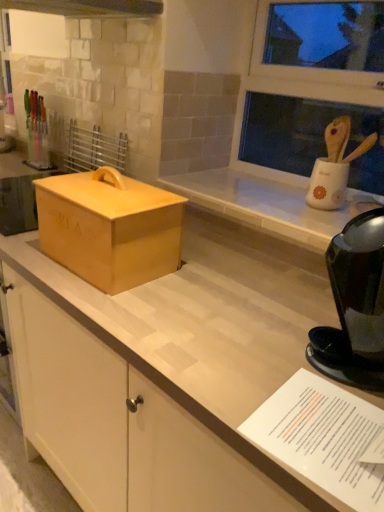
Question: Does black glossy coffee maker at right have a lesser width compared to white paper at lower right?

Choices:
 (A) yes
 (B) no

Answer: (A)

Question: From a real-world perspective, is black glossy coffee maker at right under white paper at lower right?

Choices:
 (A) no
 (B) yes

Answer: (A)

Question: Is black glossy coffee maker at right in contact with white paper at lower right?

Choices:
 (A) yes
 (B) no

Answer: (B)

Question: Is white paper at lower right at the back of black glossy coffee maker at right?

Choices:
 (A) yes
 (B) no

Answer: (B)

Question: Can you confirm if black glossy coffee maker at right is bigger than white paper at lower right?

Choices:
 (A) yes
 (B) no

Answer: (A)

Question: Considering the positions of white paper at lower right and matte yellow box at center in the image, is white paper at lower right taller or shorter than matte yellow box at center?

Choices:
 (A) short
 (B) tall

Answer: (A)

Question: Relative to matte yellow box at center, is white paper at lower right in front or behind?

Choices:
 (A) behind
 (B) front

Answer: (B)

Question: Is white paper at lower right bigger or smaller than matte yellow box at center?

Choices:
 (A) big
 (B) small

Answer: (B)

Question: From a real-world perspective, is white paper at lower right above or below matte yellow box at center?

Choices:
 (A) above
 (B) below

Answer: (B)

Question: Looking at the image, does black glossy coffee maker at right seem bigger or smaller compared to white paper at lower right?

Choices:
 (A) big
 (B) small

Answer: (A)

Question: Does point pyautogui.click(x=345, y=272) appear closer or farther from the camera than point pyautogui.click(x=309, y=404)?

Choices:
 (A) farther
 (B) closer

Answer: (A)

Question: Is black glossy coffee maker at right wider or thinner than white paper at lower right?

Choices:
 (A) wide
 (B) thin

Answer: (B)

Question: From the image's perspective, relative to white paper at lower right, is black glossy coffee maker at right above or below?

Choices:
 (A) above
 (B) below

Answer: (A)

Question: Based on their positions, is matte yellow box at center located to the left or right of black glossy coffee maker at right?

Choices:
 (A) right
 (B) left

Answer: (B)

Question: Is point (97, 182) positioned closer to the camera than point (365, 318)?

Choices:
 (A) closer
 (B) farther

Answer: (B)